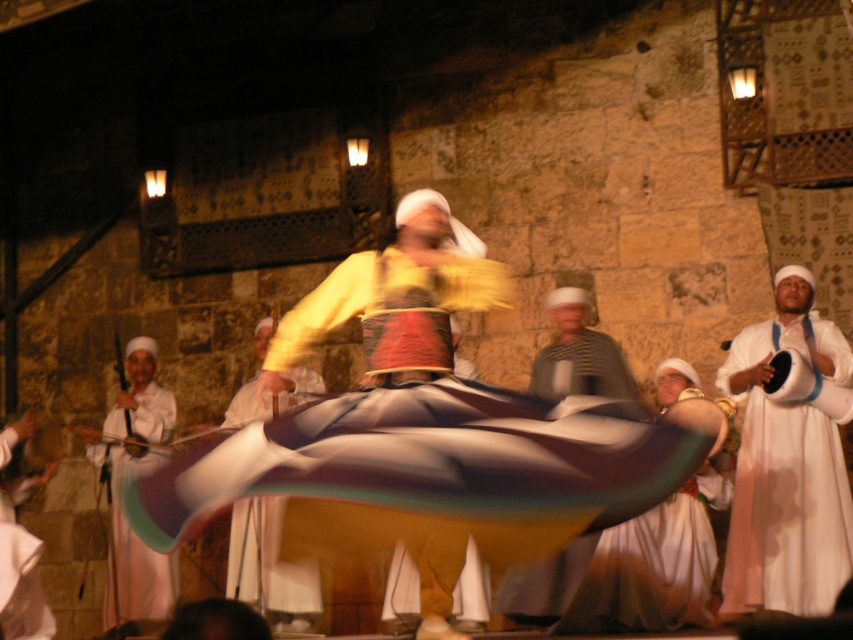
You are a photographer positioned at the center of the room, aiming to capture a closeup shot of the white cotton robe at left and the white cotton dress at center. Given that your camera has a maximum focus range of 4 meters, can you successfully focus on both subjects simultaneously?

The white cotton robe at left is 4.78 meters away from the white cotton dress at center. Since the robe is beyond the 4 meter range, the camera cannot focus on both subjects at the same time.

You are a photographer at the dance performance. You want to capture a photo of both the white cotton robe at left and the white cotton dress at center. Which object should you focus on first to ensure both are in frame?

The white cotton robe at left is to the left of the white cotton dress at center, so you should focus on the white cotton dress at center first to ensure both are in frame.